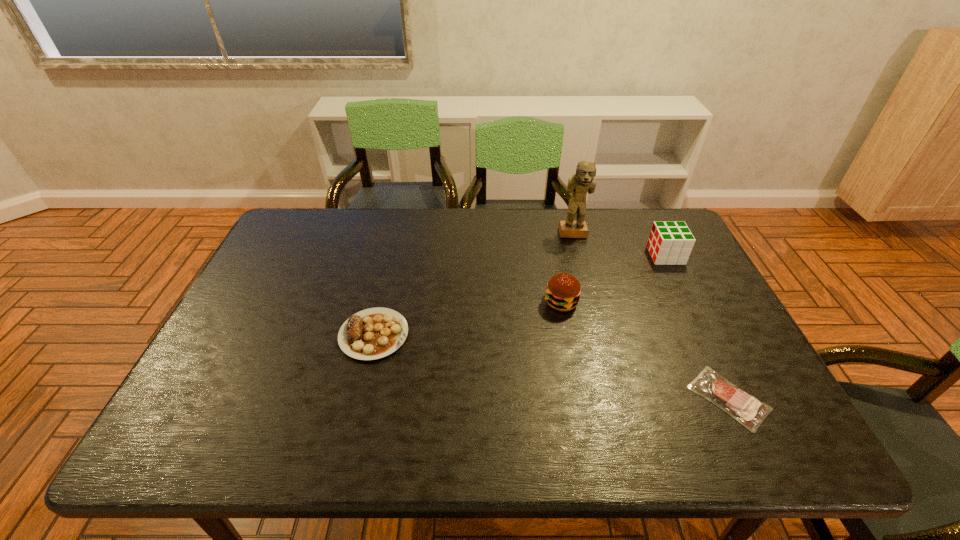
What are the coordinates of `object present at the far right corner` in the screenshot? It's located at (670, 243).

At what (x,y) coordinates should I click in order to perform the action: click on object positioned at the near right corner. Please return your answer as a coordinate pair (x, y). Looking at the image, I should click on (748, 410).

Where is `vacant region at the far edge`? This screenshot has width=960, height=540. vacant region at the far edge is located at coordinates (473, 223).

Identify the location of vacant space at the near edge of the desktop. The image size is (960, 540). (475, 443).

The width and height of the screenshot is (960, 540). In the image, there is a desktop. Identify the location of vacant space at the left edge. pyautogui.click(x=278, y=304).

The height and width of the screenshot is (540, 960). I want to click on blank space at the far left corner of the desktop, so click(301, 239).

The image size is (960, 540). Identify the location of vacant region at the far right corner of the desktop. (656, 217).

Where is `vacant space that's between the farther steak and the nearest object`? This screenshot has width=960, height=540. vacant space that's between the farther steak and the nearest object is located at coordinates (551, 366).

The width and height of the screenshot is (960, 540). Identify the location of free space between the hamburger and the nearer steak. (645, 350).

Find the location of a particular element. This screenshot has width=960, height=540. free space between the farther steak and the tallest object is located at coordinates (473, 285).